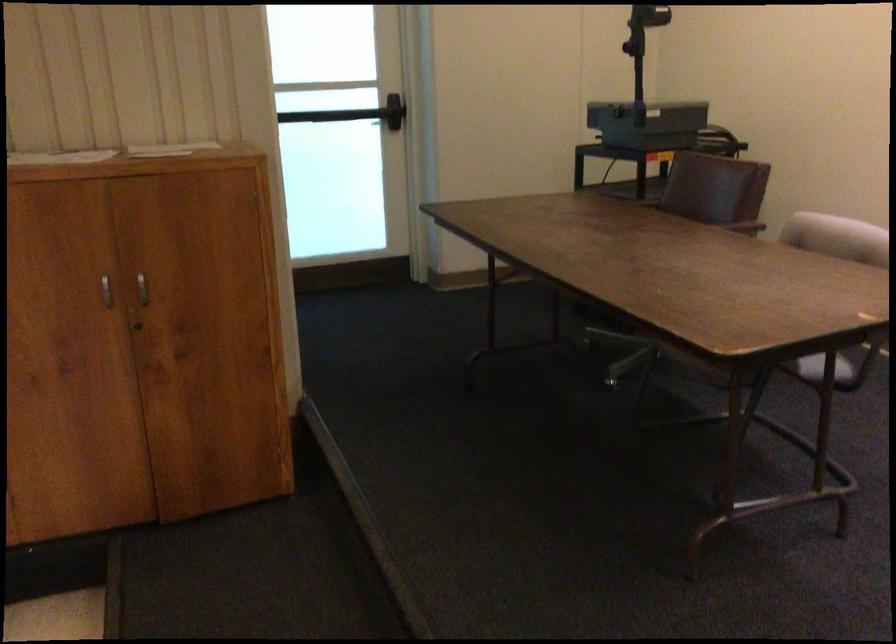
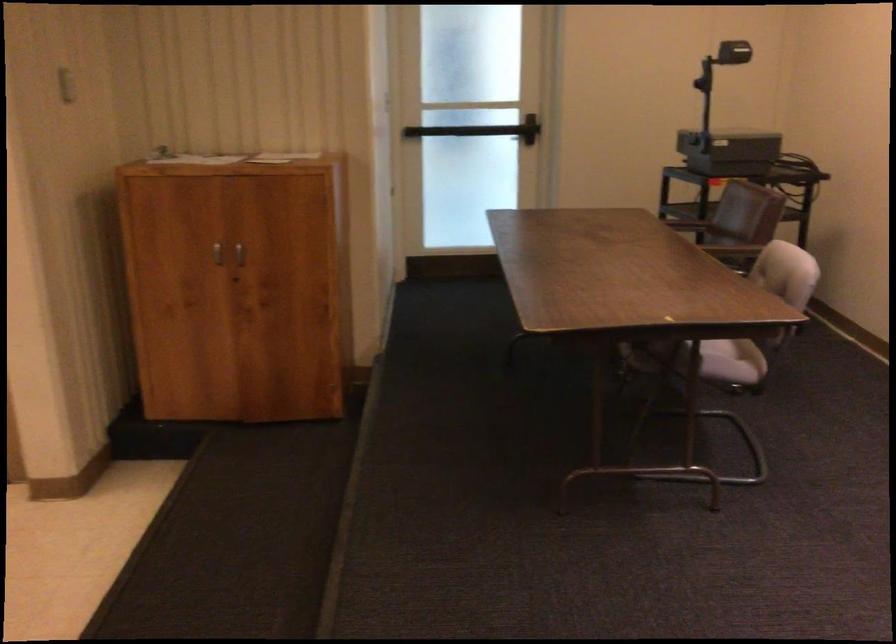
Where in the second image is the point corresponding to [110,295] from the first image?

(217, 252)